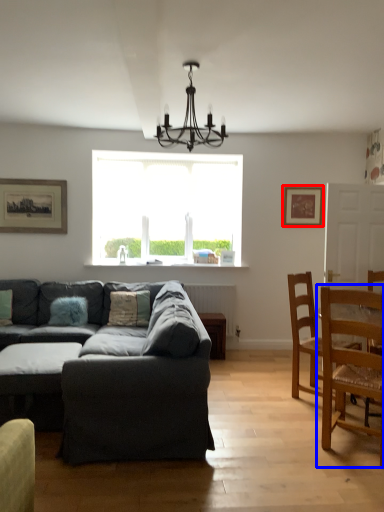
Question: Which point is closer to the camera, picture frame (highlighted by a red box) or chair (highlighted by a blue box)?

Choices:
 (A) picture frame
 (B) chair

Answer: (B)